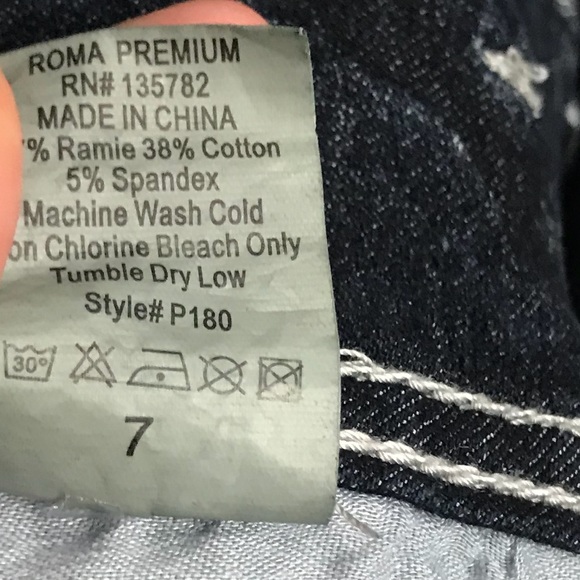
At what (x,y) coordinates should I click in order to perform the action: click on fabric. Please return your answer as a coordinate pair (x, y). Looking at the image, I should click on (436, 238).